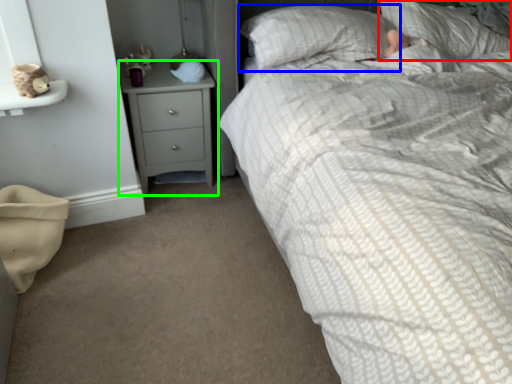
Question: Which is farther away from pillow (highlighted by a red box)? pillow (highlighted by a blue box) or chest of drawers (highlighted by a green box)?

Choices:
 (A) pillow
 (B) chest of drawers

Answer: (B)